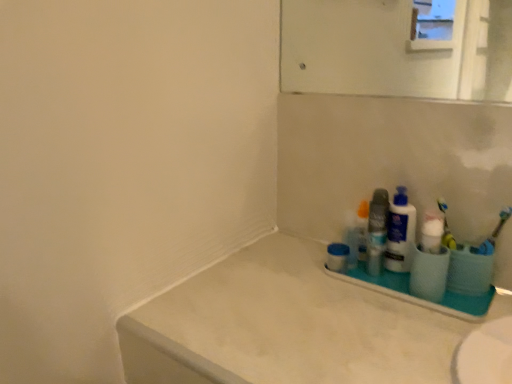
Question: From the image's perspective, is blue rubber toothbrush at right, the first toothbrush positioned from the right, located above or below yellow plastic toothbrush at right, the 2th toothbrush in the right-to-left sequence?

Choices:
 (A) above
 (B) below

Answer: (B)

Question: Choose the correct answer: Is blue rubber toothbrush at right, the first toothbrush positioned from the right, inside yellow plastic toothbrush at right, the 2th toothbrush in the right-to-left sequence, or outside it?

Choices:
 (A) outside
 (B) inside

Answer: (A)

Question: Which object is the farthest from the white plastic bottle at right, which is the 2th cleaning product in front-to-back order?

Choices:
 (A) yellow plastic toothbrush at right, the 2th toothbrush in the right-to-left sequence
 (B) blue matte jar at right
 (C) white matte counter top at lower right
 (D) white plastic tray at lower right
 (E) white plastic cup at right, which appears as the 1th cleaning product when viewed from the front

Answer: (C)

Question: Which object is the closest to the white plastic cup at right, the 2th cleaning product in the back-to-front sequence?

Choices:
 (A) blue matte jar at right
 (B) white plastic tray at lower right
 (C) blue rubber toothbrush at right, which is the second toothbrush from left to right
 (D) yellow plastic toothbrush at right, which is counted as the first toothbrush, starting from the left
 (E) white matte counter top at lower right

Answer: (D)